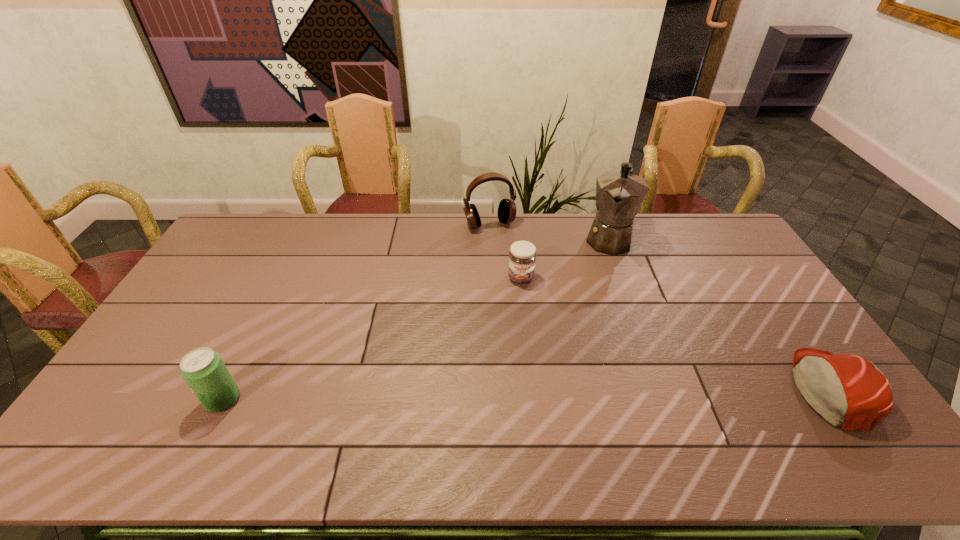
The width and height of the screenshot is (960, 540). What are the coordinates of `the leftmost object` in the screenshot? It's located at (203, 370).

At what (x,y) coordinates should I click in order to perform the action: click on the third tallest object. Please return your answer as a coordinate pair (x, y). This screenshot has width=960, height=540. Looking at the image, I should click on (203, 370).

You are a GUI agent. You are given a task and a screenshot of the screen. Output one action in this format:
    pyautogui.click(x=<x>, y=<y>)
    Task: Click on the rightmost object
    This screenshot has width=960, height=540.
    Given the screenshot: What is the action you would take?
    pyautogui.click(x=848, y=391)

Locate an element on the screen. jam is located at coordinates (522, 257).

Find the location of a particular element. This screenshot has height=540, width=960. the second tallest object is located at coordinates (506, 213).

Identify the location of the second object from right to left. (619, 194).

The width and height of the screenshot is (960, 540). Find the location of `the tallest object`. the tallest object is located at coordinates (619, 194).

This screenshot has height=540, width=960. In order to click on free space located 0.120m on the left of the third tallest object in this screenshot , I will do `click(159, 399)`.

Image resolution: width=960 pixels, height=540 pixels. What are the coordinates of `vacant region located on the front label of the jam` in the screenshot? It's located at (524, 313).

Identify the location of vacant region located on the front label of the jam. The width and height of the screenshot is (960, 540). (527, 341).